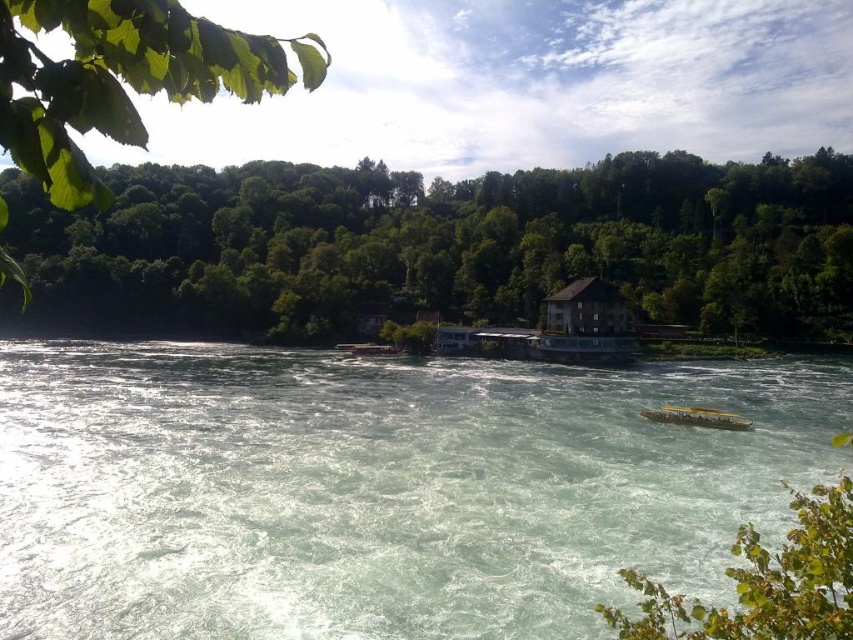
You are a boat captain navigating a narrow river. You see the white frothy water at center and the green leafy trees at upper center. The distance between them is crucial for your route planning. Can you safely navigate your 100 meter long boat between these two landmarks without touching either?

The distance between the white frothy water at center and the green leafy trees at upper center is 94.21 meters. Since the boat is 100 meters long, it would not be possible to safely navigate between them as the distance is shorter than the boat.

You are a kayaker planning to navigate the river shown in the image. You see the white frothy water at center and the green leafy trees at upper center. Which object is located to the right of the other?

The white frothy water at center is positioned on the right side of green leafy trees at upper center.

You are standing at the edge of the river and want to take a photo of the white frothy water at center. If your camera has a maximum focus range of 20 meters, will you be able to capture it clearly?

The white frothy water at center is 20.56 meters away from the camera. Since the maximum focus range is 20 meters, the camera cannot focus clearly on the white frothy water at center as it is beyond the range.